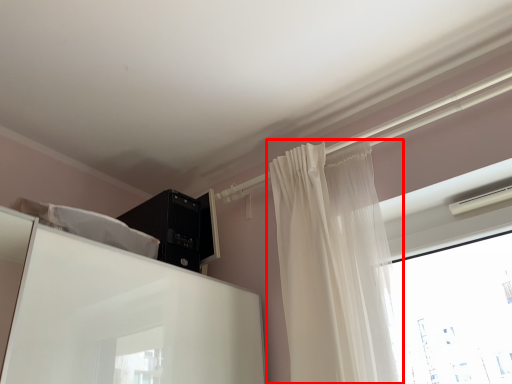
Question: From the image's perspective, what is the correct spatial positioning of curtain (annotated by the red box) in reference to appliance?

Choices:
 (A) below
 (B) above

Answer: (A)